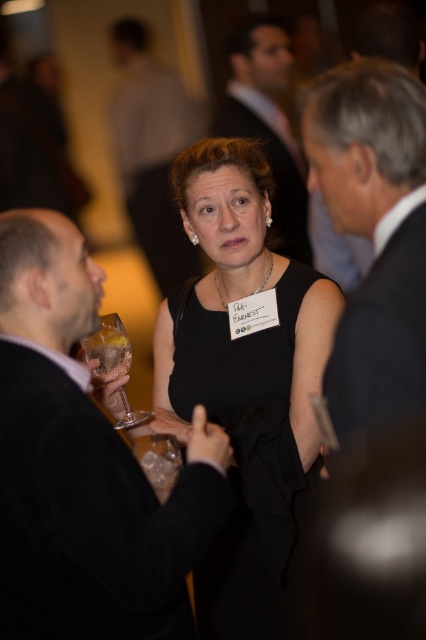
Question: Is black matte suit at left closer to camera compared to translucent glass at left?

Choices:
 (A) no
 (B) yes

Answer: (B)

Question: Among these objects, which one is nearest to the camera?

Choices:
 (A) clear glass wine glass at center
 (B) black suit at center

Answer: (A)

Question: Which point appears farthest from the camera in this image?

Choices:
 (A) (262, 93)
 (B) (98, 342)
 (C) (347, 508)

Answer: (A)

Question: Considering the relative positions of black matte suit at left and black suit at upper right in the image provided, where is black matte suit at left located with respect to black suit at upper right?

Choices:
 (A) above
 (B) below

Answer: (B)

Question: Is black matte suit at left positioned before black suit at upper right?

Choices:
 (A) yes
 (B) no

Answer: (B)

Question: Which point is farther from the camera taking this photo?

Choices:
 (A) (112, 461)
 (B) (365, 104)
 (C) (264, 29)
 (D) (118, 144)

Answer: (D)